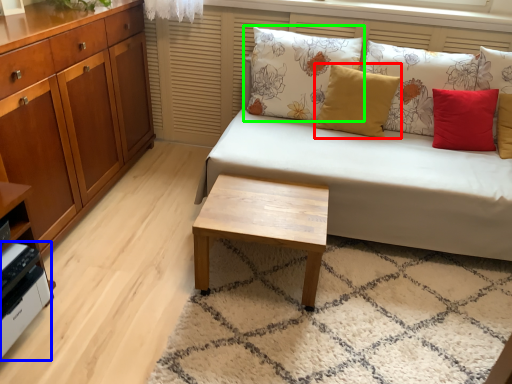
Question: Which object is positioned farthest from pillow (highlighted by a red box)? Select from appliance (highlighted by a blue box) and pillow (highlighted by a green box).

Choices:
 (A) appliance
 (B) pillow

Answer: (A)